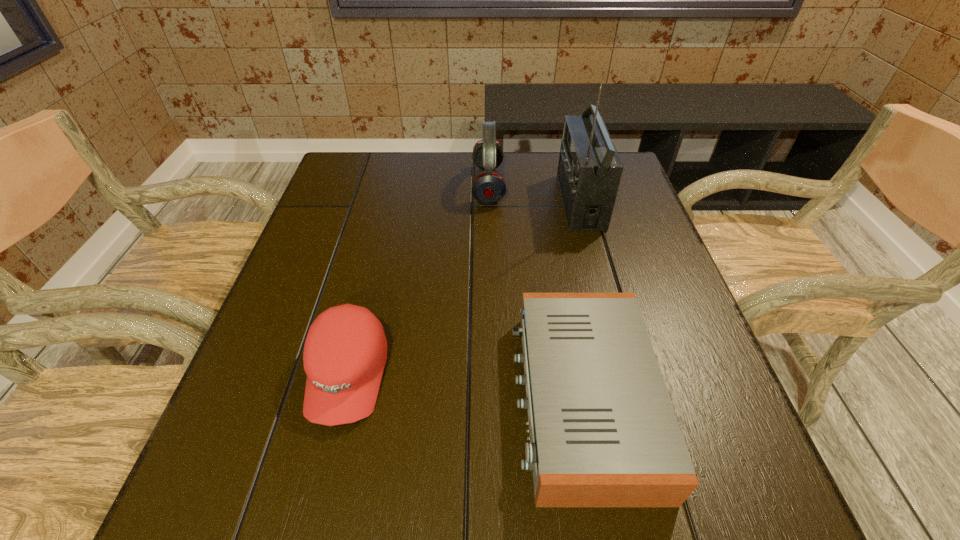
Identify the location of object located in the far right corner section of the desktop. (589, 171).

Find the location of a particular element. object present at the near right corner is located at coordinates (603, 432).

Find the location of a particular element. The width and height of the screenshot is (960, 540). vacant space at the far edge of the desktop is located at coordinates (540, 154).

Image resolution: width=960 pixels, height=540 pixels. In the image, there is a desktop. In order to click on vacant space at the near edge in this screenshot , I will do `click(310, 481)`.

In the image, there is a desktop. Identify the location of vacant space at the left edge. The image size is (960, 540). (207, 469).

In order to click on vacant region at the right edge in this screenshot , I will do `click(638, 212)`.

Locate an element on the screen. Image resolution: width=960 pixels, height=540 pixels. vacant region at the far left corner is located at coordinates (345, 155).

You are a GUI agent. You are given a task and a screenshot of the screen. Output one action in this format:
    pyautogui.click(x=<x>, y=<y>)
    Task: Click on the vacant space at the near left corner of the desktop
    
    Given the screenshot: What is the action you would take?
    pyautogui.click(x=252, y=505)

What are the coordinates of `free space between the earphone and the cap` in the screenshot? It's located at (418, 280).

Where is `vacant point located between the leftmost object and the earphone`? The width and height of the screenshot is (960, 540). vacant point located between the leftmost object and the earphone is located at coordinates (418, 280).